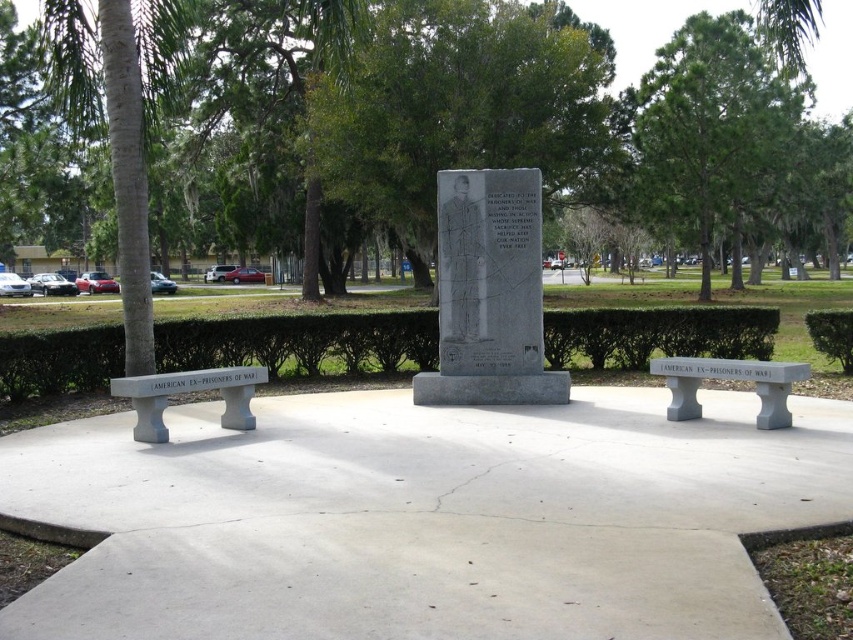
Consider the image. You are standing in the park and see the gray concrete bench at left and the green hedge at center. Which object is positioned to the right of the other?

The green hedge at center is positioned to the right of the gray concrete bench at left.

You are planning to place a new flower pot between the gray concrete bench at center and the gray stone monument at center. Considering their sizes, which object should the flower pot be placed closer to?

The gray concrete bench at center occupies less space than the gray stone monument at center, so the flower pot should be placed closer to the gray stone monument at center to balance the space.